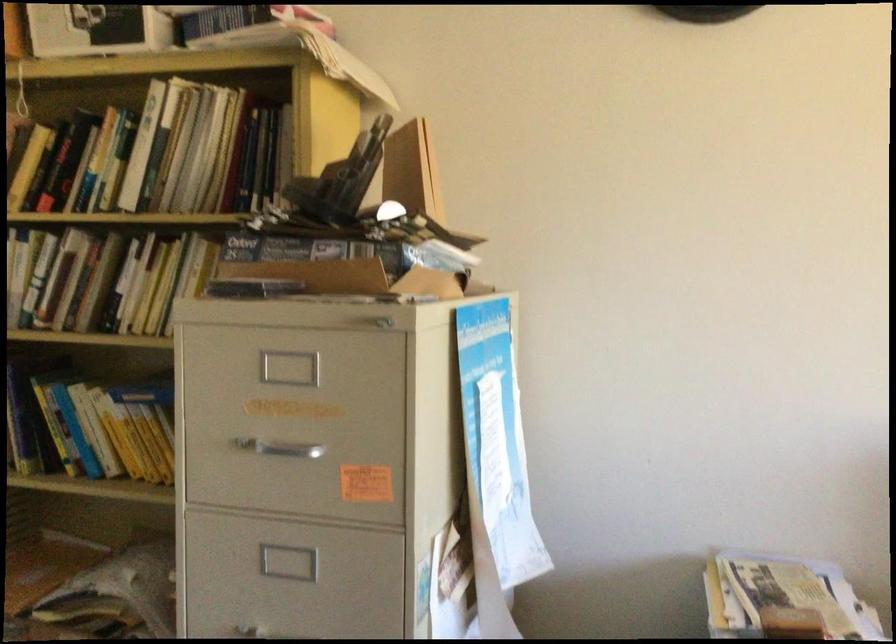
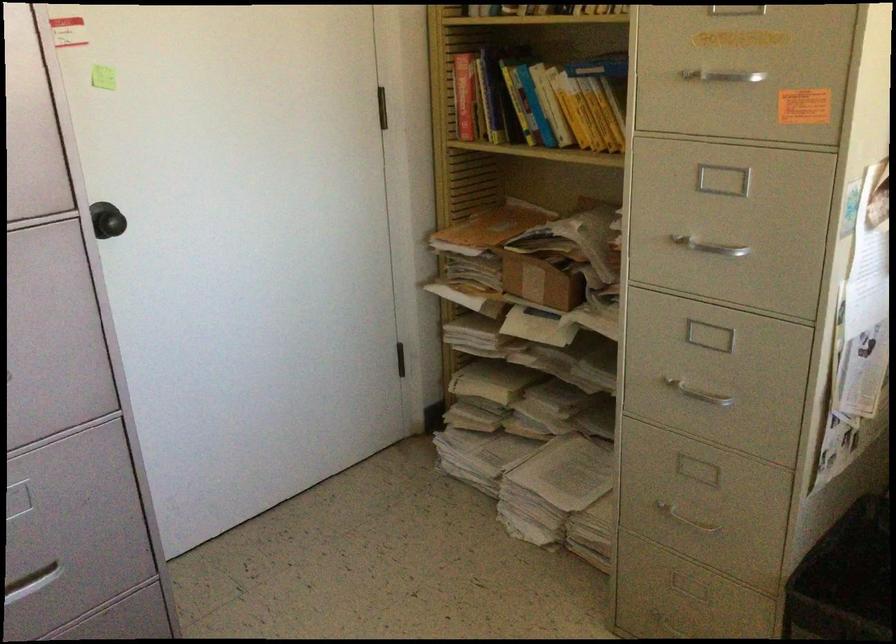
Locate, in the second image, the point that corresponds to (x=290, y=453) in the first image.

(725, 82)